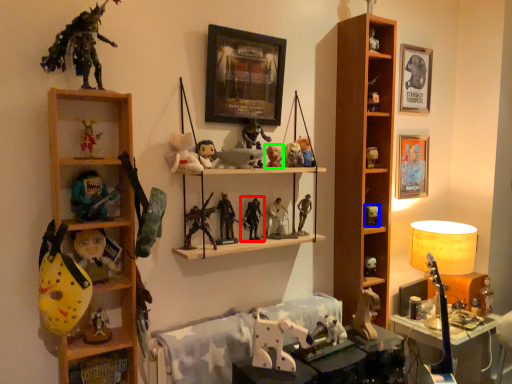
Question: Which object is the farthest from toy (highlighted by a red box)? Choose among these: toy (highlighted by a blue box) or toy (highlighted by a green box).

Choices:
 (A) toy
 (B) toy

Answer: (A)